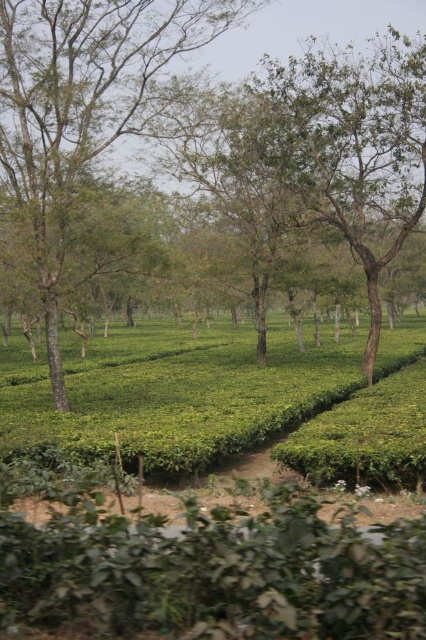
Is green leafy hedge at lower center positioned behind green leafy tree at center?

No, green leafy hedge at lower center is in front of green leafy tree at center.

Between green leafy hedge at lower center and green leafy tree at center, which one has more height?

green leafy hedge at lower center is taller.

This screenshot has width=426, height=640. What do you see at coordinates (215, 572) in the screenshot? I see `green leafy hedge at lower center` at bounding box center [215, 572].

Find the location of a particular element. green leafy hedge at lower center is located at coordinates (215, 572).